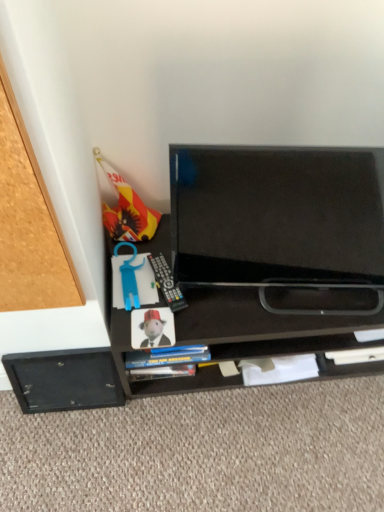
Identify the location of empty space that is to the right of matte paper book at center. (216, 318).